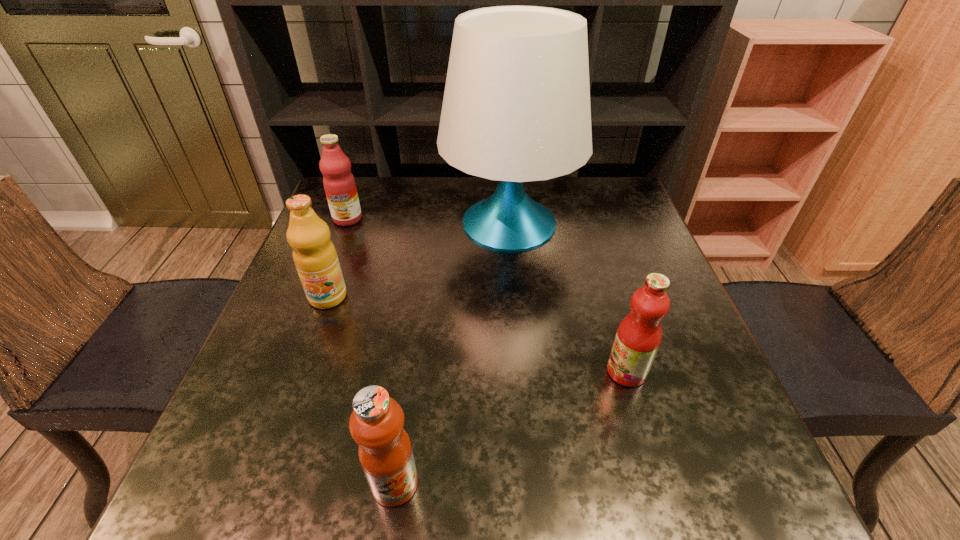
Locate an element on the screen. This screenshot has height=540, width=960. vacant space situated 0.160m on the front label of the second nearest object is located at coordinates (522, 372).

This screenshot has width=960, height=540. What are the coordinates of `vacant point located on the front label of the second nearest object` in the screenshot? It's located at (426, 372).

The height and width of the screenshot is (540, 960). Identify the location of free space located 0.300m on the front label of the second nearest object. (447, 372).

Image resolution: width=960 pixels, height=540 pixels. What are the coordinates of `table lamp present at the far edge` in the screenshot? It's located at (516, 108).

Where is `fruit juice situated at the far edge`? The height and width of the screenshot is (540, 960). fruit juice situated at the far edge is located at coordinates (339, 184).

This screenshot has height=540, width=960. In order to click on object at the near edge in this screenshot , I will do `click(376, 423)`.

Locate an element on the screen. The image size is (960, 540). object that is positioned at the right edge is located at coordinates (638, 337).

Where is `object at the far left corner`? object at the far left corner is located at coordinates point(339,184).

I want to click on vacant space at the far edge, so click(397, 205).

Image resolution: width=960 pixels, height=540 pixels. In the image, there is a desktop. In order to click on vacant space at the near edge in this screenshot , I will do (x=634, y=469).